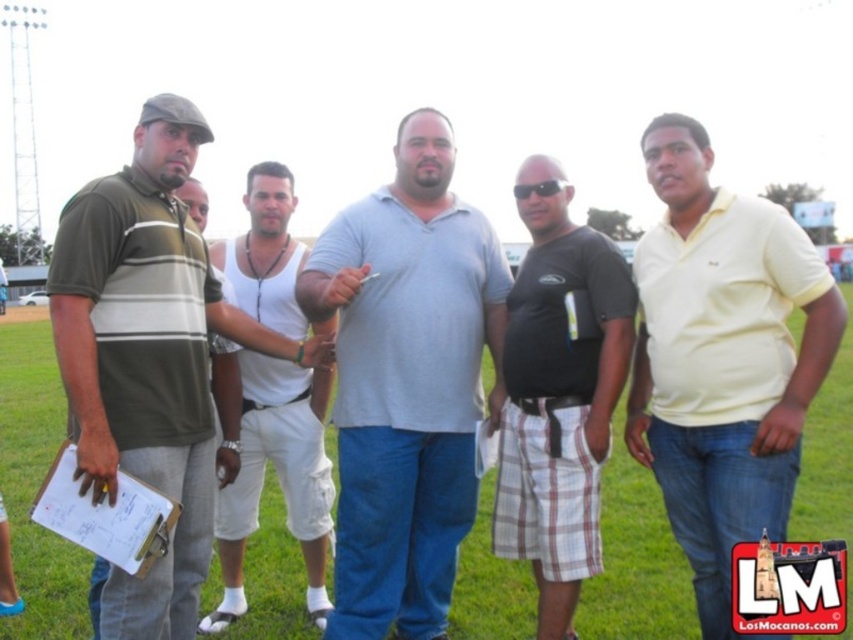
Question: Is the position of yellow cotton polo shirt at center more distant than that of black plastic sunglasses at center?

Choices:
 (A) yes
 (B) no

Answer: (B)

Question: Which point is closer to the camera taking this photo?

Choices:
 (A) (537, 186)
 (B) (167, 285)
 (C) (648, 129)
 (D) (344, 541)

Answer: (B)

Question: Which object is farther from the camera taking this photo?

Choices:
 (A) matte green polo shirt at left
 (B) black plastic sunglasses at center
 (C) black cotton t-shirt at center
 (D) gray matte shirt at center

Answer: (B)

Question: Can you confirm if yellow cotton polo shirt at center is bigger than black plastic sunglasses at center?

Choices:
 (A) no
 (B) yes

Answer: (B)

Question: Is the position of green grass at center more distant than that of black cotton t-shirt at center?

Choices:
 (A) no
 (B) yes

Answer: (A)

Question: Based on their relative distances, which object is farther from the black cotton t-shirt at center?

Choices:
 (A) yellow cotton polo shirt at center
 (B) white cotton tank top at center
 (C) gray matte shirt at center

Answer: (B)